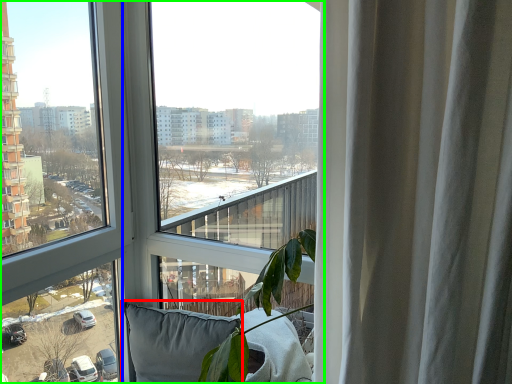
Question: Which object is positioned farthest from pillow (highlighted by a red box)? Select from window (highlighted by a blue box) and window (highlighted by a green box).

Choices:
 (A) window
 (B) window

Answer: (B)